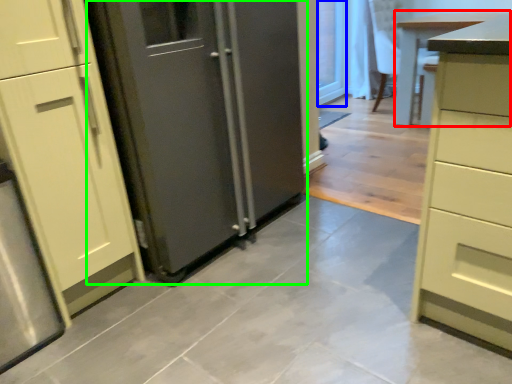
Question: Considering the real-world distances, which object is farthest from table (highlighted by a red box)? glass door (highlighted by a blue box) or door (highlighted by a green box)?

Choices:
 (A) glass door
 (B) door

Answer: (B)